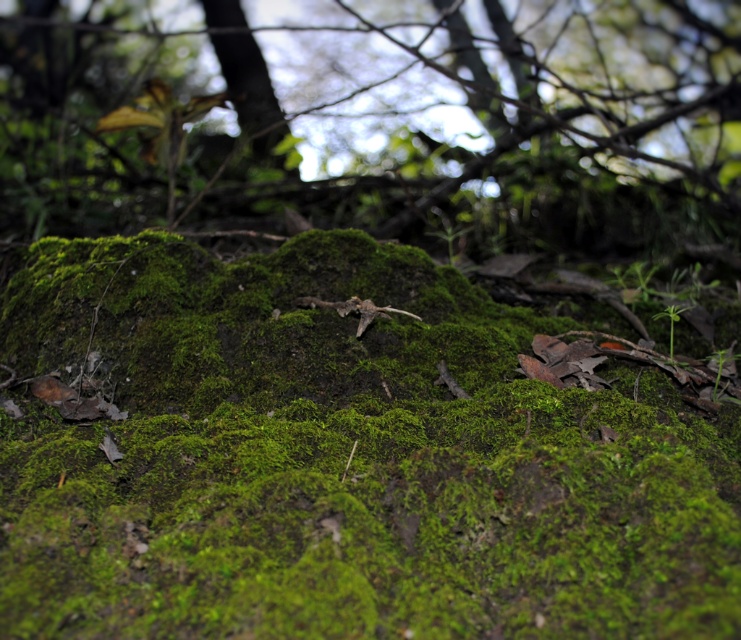
You are a botanist studying moss growth patterns. You have a GPS device that shows coordinates on the image. You need to locate the green fuzzy moss at center. What are the coordinates where you should look?

The green fuzzy moss at center is located at coordinates point (339, 460).

You are a hiker trying to navigate through the forest. You see the green mossy rock at center and the smooth brown tree trunk at upper center. Which object is positioned to the right of the other?

The green mossy rock at center is to the right of the smooth brown tree trunk at upper center.

You are a photographer aiming to capture the green fuzzy moss at center and the green mossy rock at center. Which object will appear larger in your photo due to its proximity to the camera?

The green fuzzy moss at center will appear larger in the photo because it is closer to the viewer compared to the green mossy rock at center.